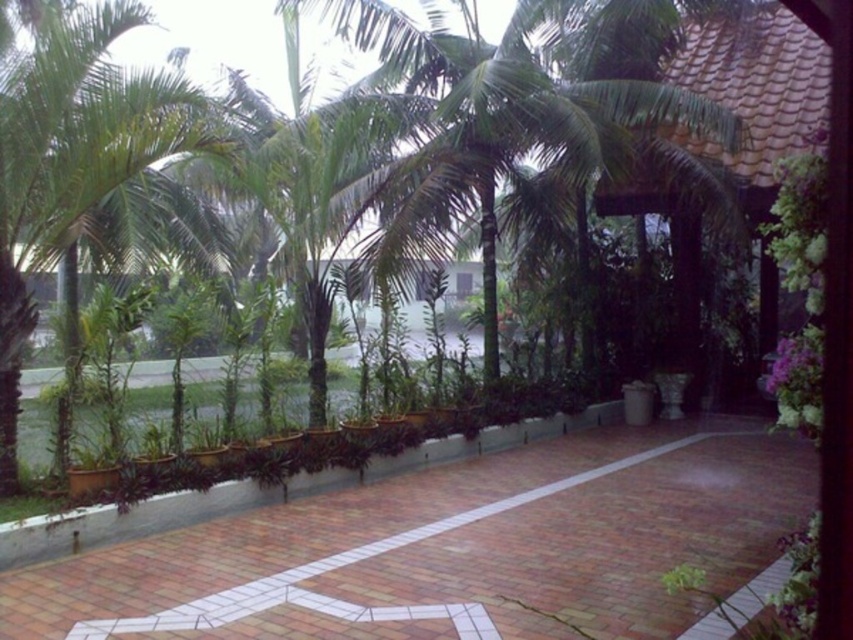
Who is positioned more to the right, brick pavement at center or green leafy palm tree at left?

Positioned to the right is brick pavement at center.

Is brick pavement at center above green leafy palm tree at left?

Actually, brick pavement at center is below green leafy palm tree at left.

Identify the location of brick pavement at center. (450, 550).